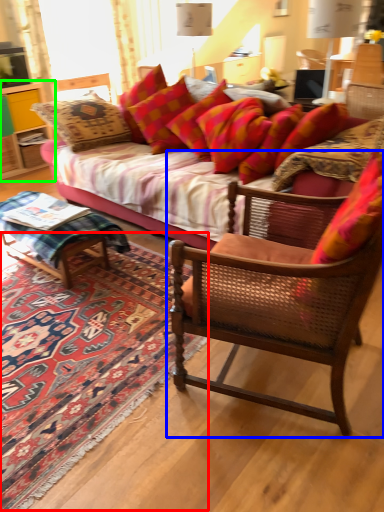
Question: Which object is positioned farthest from mat (highlighted by a red box)? Select from chair (highlighted by a blue box) and cabinetry (highlighted by a green box).

Choices:
 (A) chair
 (B) cabinetry

Answer: (B)